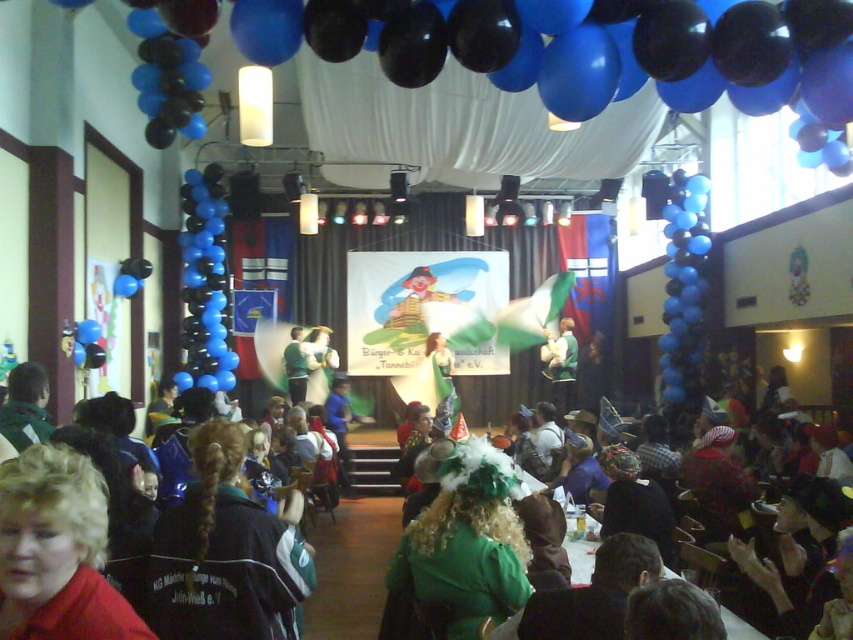
Is point (494, 492) positioned before point (657, 612)?

No, it is not.

Does green velvet hat at center have a larger size compared to dark brown hair at lower right?

Yes, green velvet hat at center is bigger than dark brown hair at lower right.

Is point (381, 630) positioned in front of point (692, 593)?

No.

Identify the location of green velvet hat at center. This screenshot has width=853, height=640. (461, 548).

Can you confirm if blue glossy balloons at center is wider than black matte balloons at right?

Correct, the width of blue glossy balloons at center exceeds that of black matte balloons at right.

Does point (221, 388) lie in front of point (688, 260)?

No, (221, 388) is behind (688, 260).

Where is `blue glossy balloons at center`? Image resolution: width=853 pixels, height=640 pixels. blue glossy balloons at center is located at coordinates (206, 280).

The width and height of the screenshot is (853, 640). Find the location of `blue glossy balloons at center`. blue glossy balloons at center is located at coordinates (206, 280).

Which is behind, point (614, 536) or point (535, 486)?

The point (535, 486) is behind.

The width and height of the screenshot is (853, 640). Find the location of `green fabric dress at lower center`. green fabric dress at lower center is located at coordinates click(593, 593).

Image resolution: width=853 pixels, height=640 pixels. Describe the element at coordinates (593, 593) in the screenshot. I see `green fabric dress at lower center` at that location.

I want to click on green fabric dress at lower center, so click(593, 593).